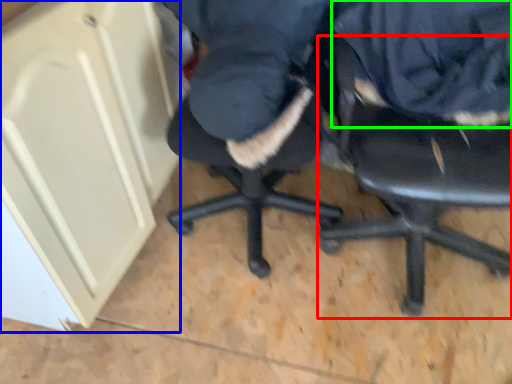
Question: Based on their relative distances, which object is farther from chair (highlighted by a red box)? Choose from cabinetry (highlighted by a blue box) and clothing (highlighted by a green box).

Choices:
 (A) cabinetry
 (B) clothing

Answer: (A)